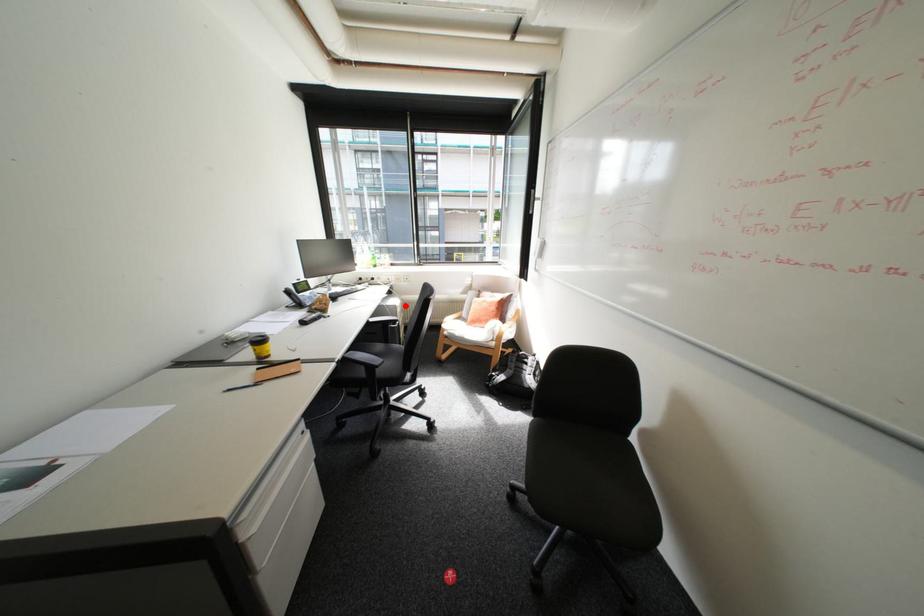
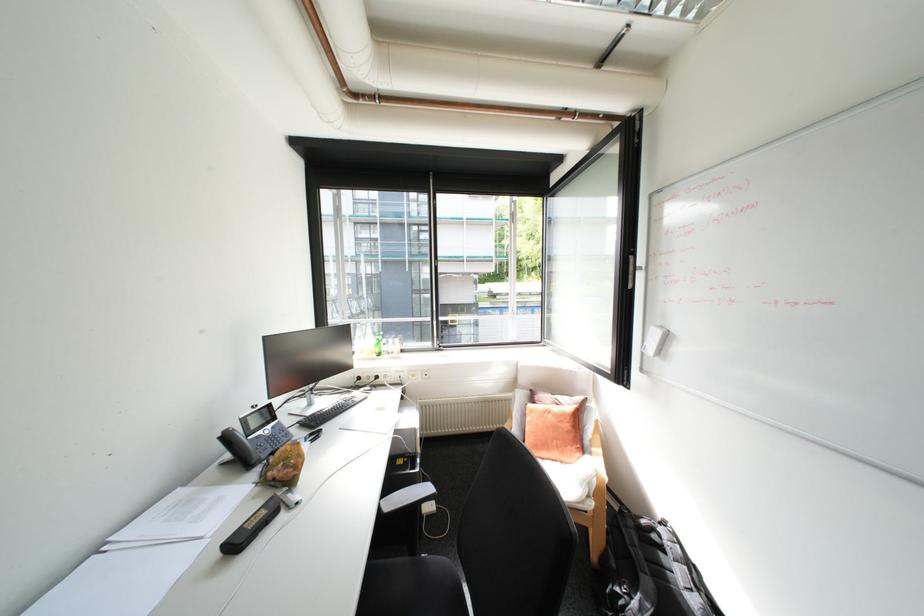
Locate, in the second image, the point that corresponds to the highlighted location in the first image.

(424, 429)